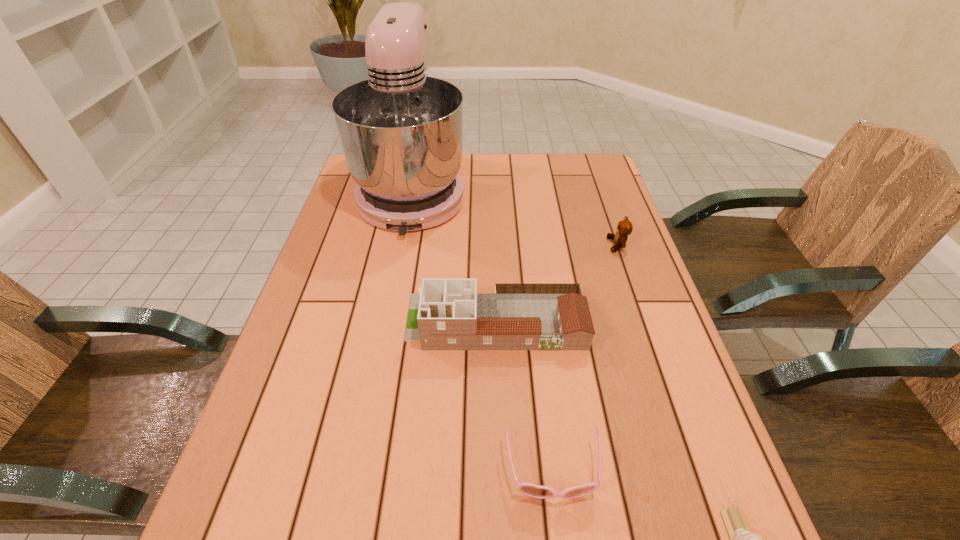
Where is `free space between the teddy bear and the tallest object`? free space between the teddy bear and the tallest object is located at coordinates (516, 218).

Locate an element on the screen. vacant space in between the teddy bear and the sunglasses is located at coordinates (585, 359).

Locate an element on the screen. empty space between the fourth tallest object and the third nearest object is located at coordinates (524, 396).

Where is `blank region between the third farthest object and the third shortest object`? blank region between the third farthest object and the third shortest object is located at coordinates pyautogui.click(x=557, y=283).

You are a GUI agent. You are given a task and a screenshot of the screen. Output one action in this format:
    pyautogui.click(x=<x>, y=<y>)
    Task: Click on the vacant space that's between the teddy bear and the third farthest object
    
    Given the screenshot: What is the action you would take?
    pyautogui.click(x=557, y=283)

Where is `object identified as the third closest to the mixer`? object identified as the third closest to the mixer is located at coordinates (539, 492).

Locate which object is the closest to the escargot. Please provide its 2D coordinates. Your answer should be formatted as a tuple, i.e. [(x, y)], where the tuple contains the x and y coordinates of a point satisfying the conditions above.

[(539, 492)]

Where is `free space that satisfies the following two spatial constraints: 1. on the front-facing side of the third tallest object; 2. on the front-facing side of the sunglasses`? The image size is (960, 540). free space that satisfies the following two spatial constraints: 1. on the front-facing side of the third tallest object; 2. on the front-facing side of the sunglasses is located at coordinates (697, 472).